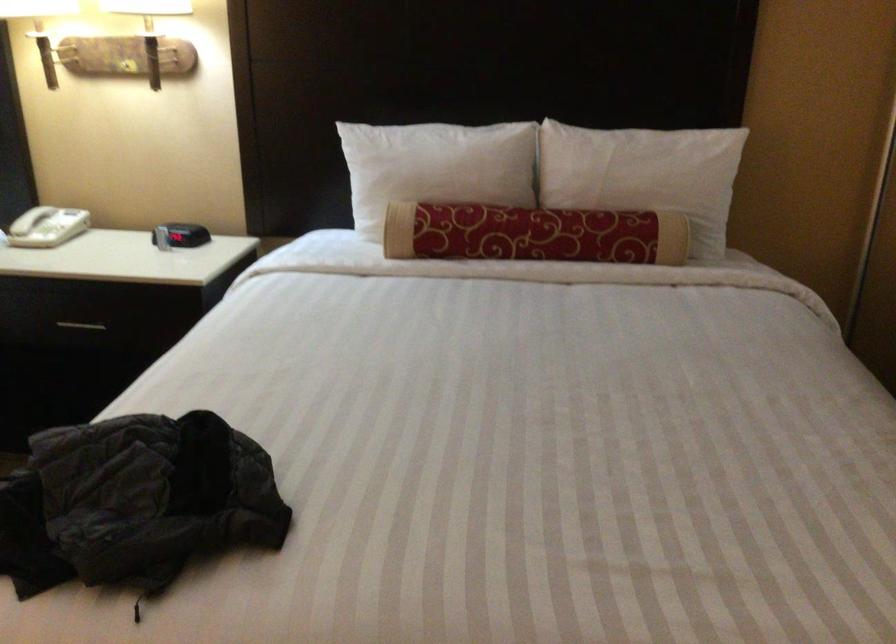
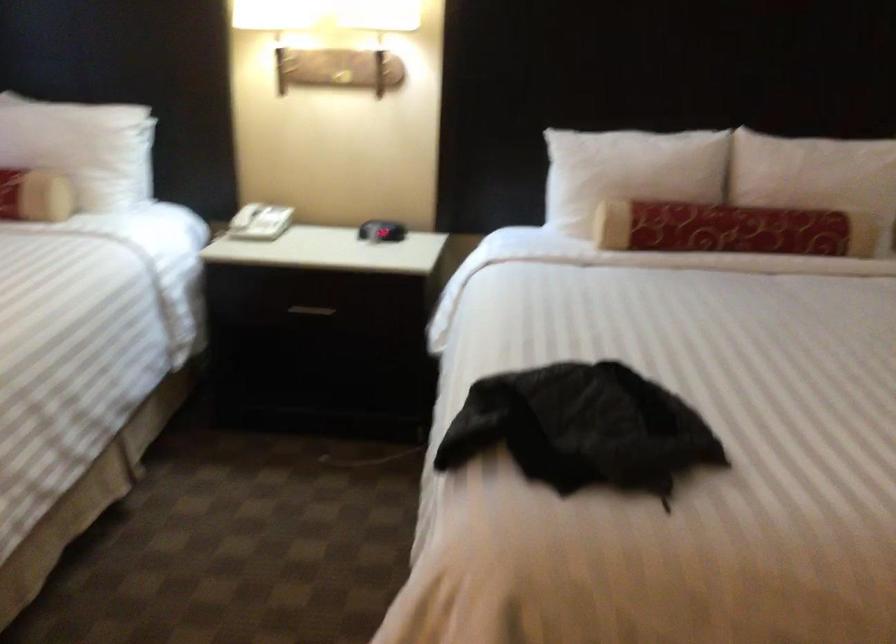
What movement of the cameraman would produce the second image?

The cameraman walked toward left, backward.